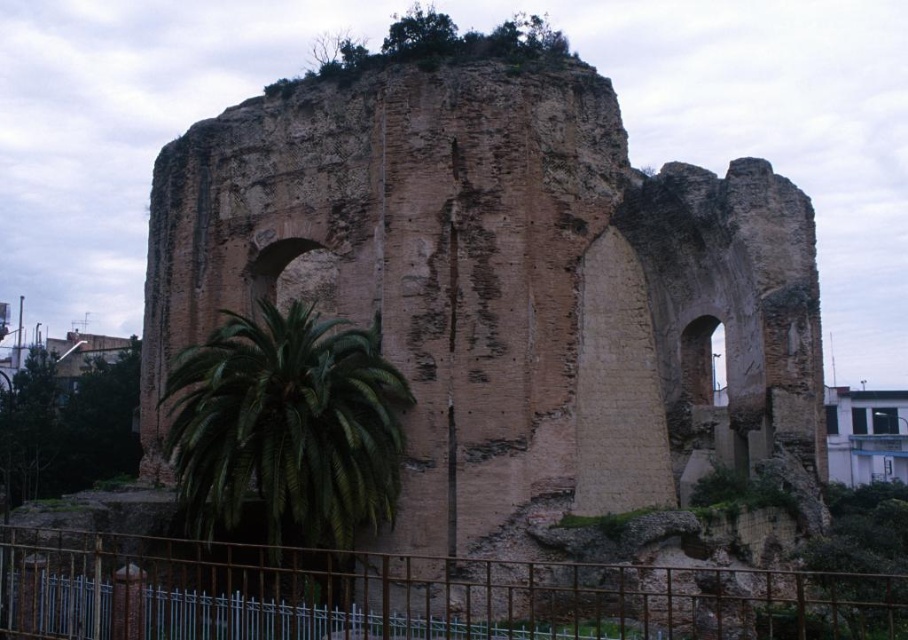
Question: Among these objects, which one is nearest to the camera?

Choices:
 (A) brown stone ruins at center
 (B) green leafy palm at lower left
 (C) rusty metal fence at lower left

Answer: (C)

Question: Which object appears closest to the camera in this image?

Choices:
 (A) rusty metal fence at lower left
 (B) green leafy palm at lower left

Answer: (A)

Question: Is rusty metal fence at lower left further to camera compared to green leafy palm at lower left?

Choices:
 (A) yes
 (B) no

Answer: (B)

Question: Does rusty metal fence at lower left have a larger size compared to green leafy palm at lower left?

Choices:
 (A) yes
 (B) no

Answer: (B)

Question: Which of the following is the closest to the observer?

Choices:
 (A) rusty metal fence at lower left
 (B) green leafy palm at lower left

Answer: (A)

Question: In this image, where is rusty metal fence at lower left located relative to green leafy palm at lower left?

Choices:
 (A) above
 (B) below

Answer: (B)